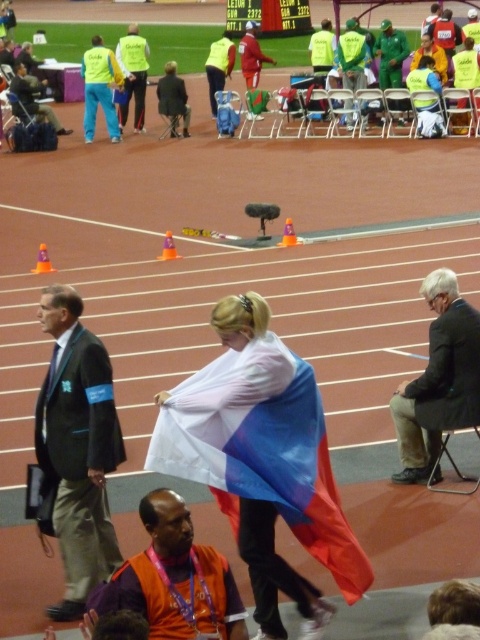
Does dark green suit at center appear on the left side of green fabric jacket at center?

Indeed, dark green suit at center is positioned on the left side of green fabric jacket at center.

Between dark green suit at center and green fabric jacket at center, which one has less height?

Standing shorter between the two is green fabric jacket at center.

Does point (81, 573) come in front of point (360, 56)?

Yes.

Image resolution: width=480 pixels, height=640 pixels. Find the location of `dark green suit at center`. dark green suit at center is located at coordinates (78, 449).

Between point (352, 582) and point (459, 339), which one is positioned in front?

Point (352, 582)

Is polyester flag at center to the right of dark gray suit at center from the viewer's perspective?

In fact, polyester flag at center is to the left of dark gray suit at center.

Which is in front, point (286, 372) or point (444, 273)?

Positioned in front is point (286, 372).

I want to click on polyester flag at center, so click(263, 448).

Which of these two, polyester flag at center or matte black suit at left, stands taller?

matte black suit at left

At what (x,y) coordinates should I click in order to perform the action: click on polyester flag at center. Please return your answer as a coordinate pair (x, y). The image size is (480, 640). Looking at the image, I should click on (263, 448).